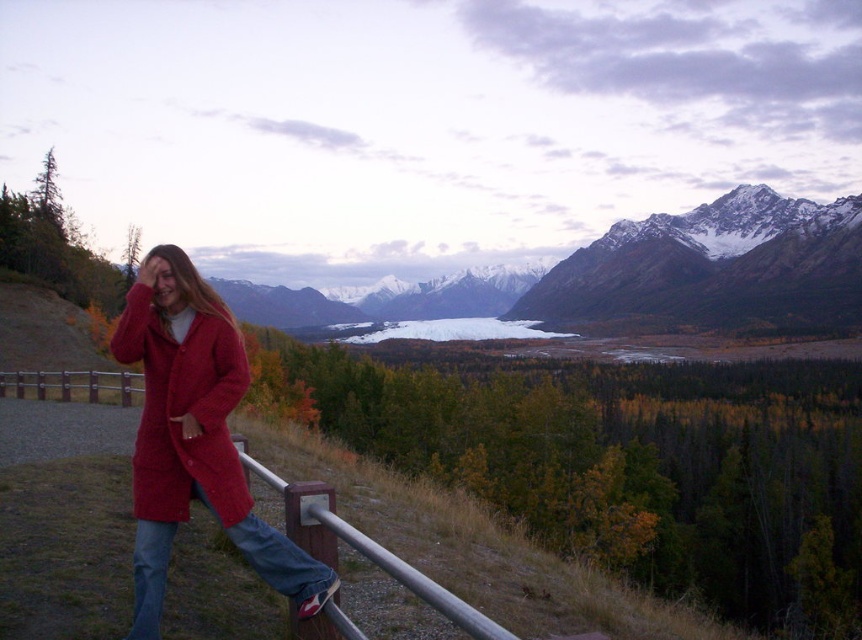
Question: Is snowy granite mountain at upper right further to the viewer compared to matte red coat at left?

Choices:
 (A) yes
 (B) no

Answer: (A)

Question: Based on their relative distances, which object is farther from the matte red coat at left?

Choices:
 (A) matte red coat at center
 (B) brushed metal rail at lower center

Answer: (B)

Question: Does matte red coat at center have a larger size compared to matte red coat at left?

Choices:
 (A) no
 (B) yes

Answer: (B)

Question: Is matte red coat at center positioned in front of matte red coat at left?

Choices:
 (A) no
 (B) yes

Answer: (B)

Question: Which point is closer to the camera?

Choices:
 (A) (696, 228)
 (B) (428, 592)
 (C) (214, 506)

Answer: (B)

Question: Which point is farther to the camera?

Choices:
 (A) (138, 308)
 (B) (840, 252)
 (C) (378, 556)

Answer: (B)